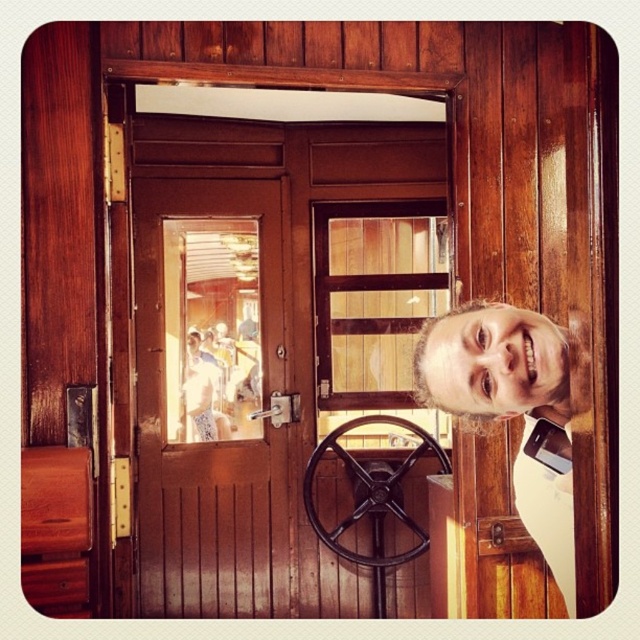
Is point (522, 356) farther from viewer compared to point (298, 404)?

That is False.

Where is `smooth skin face at center`? smooth skin face at center is located at coordinates (492, 362).

In the scene shown: Does brown wooden door at center have a larger size compared to matte brown nose at center?

Indeed, brown wooden door at center has a larger size compared to matte brown nose at center.

Is brown wooden door at center above matte brown nose at center?

No, brown wooden door at center is not above matte brown nose at center.

Is point (180, 420) closer to camera compared to point (480, 339)?

No, (180, 420) is further to viewer.

This screenshot has width=640, height=640. In order to click on brown wooden door at center in this screenshot , I will do `click(211, 396)`.

Who is higher up, brown wooden door at center or metallic silver door handle at center?

Positioned higher is brown wooden door at center.

Is point (243, 566) farther from viewer compared to point (266, 416)?

Yes, point (243, 566) is behind point (266, 416).

The image size is (640, 640). In order to click on brown wooden door at center in this screenshot , I will do `click(211, 396)`.

Locate an element on the screen. The image size is (640, 640). brown wooden door at center is located at coordinates (211, 396).